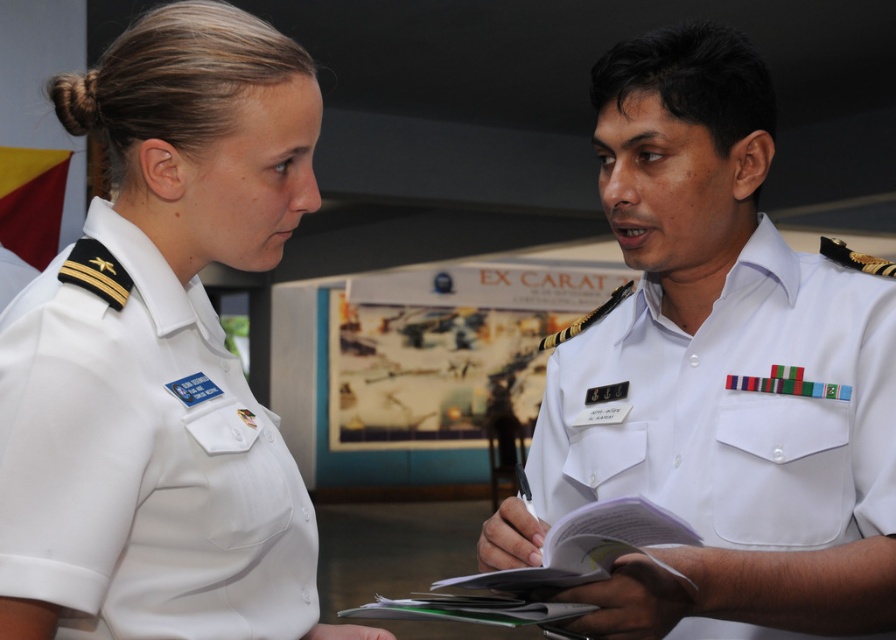
What is the exact location of the white uniform at right in the image?

The white uniform at right is located at point (721, 371).

You are a tailor who needs to determine which garment requires more fabric based on their sizes. Which one between the white uniform at right and the white cotton shirt at upper left would need more fabric?

The white uniform at right is larger in size than the white cotton shirt at upper left, so it would require more fabric.